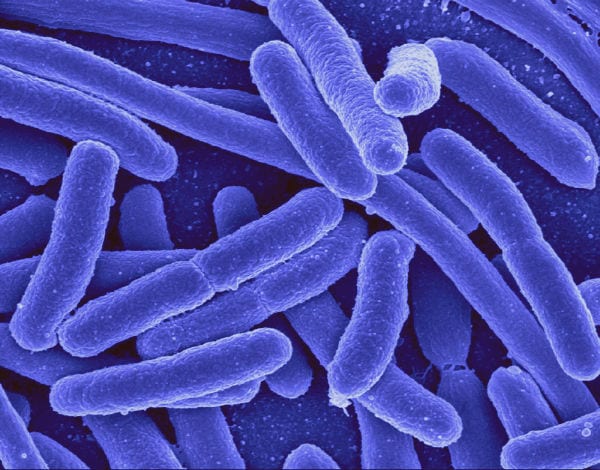
I want to click on glass dish, so click(x=280, y=230).